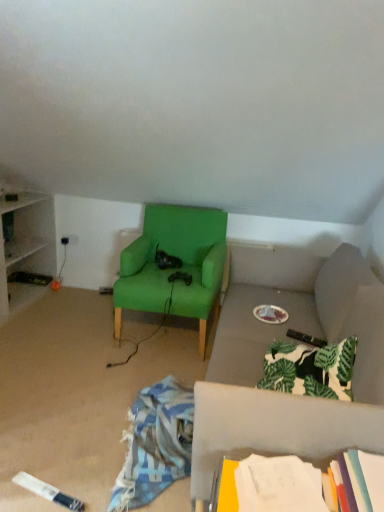
What do you see at coordinates (171, 269) in the screenshot? The height and width of the screenshot is (512, 384). I see `green fabric chair at center` at bounding box center [171, 269].

The height and width of the screenshot is (512, 384). Identify the location of green fabric chair at center. (171, 269).

Find the location of a particular element. The image size is (384, 512). green fabric chair at center is located at coordinates (171, 269).